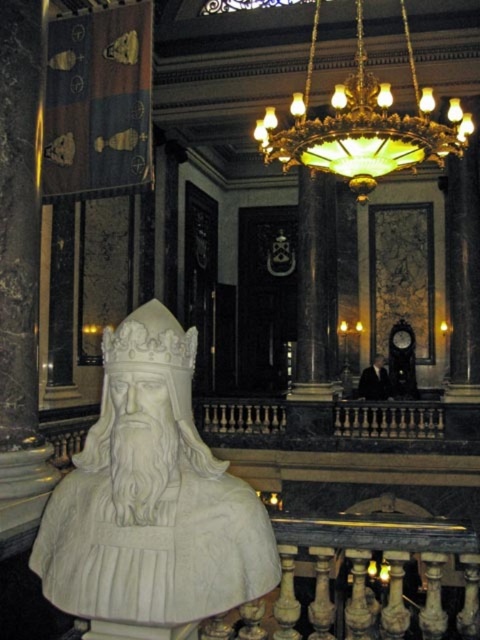
Question: Can you confirm if white marble bust at center is positioned below green stained glass chandelier at upper center?

Choices:
 (A) no
 (B) yes

Answer: (B)

Question: Can you confirm if white marble bust at center is positioned above green stained glass chandelier at upper center?

Choices:
 (A) no
 (B) yes

Answer: (A)

Question: Which of the following is the closest to the observer?

Choices:
 (A) white marble bust at center
 (B) green stained glass chandelier at upper center

Answer: (A)

Question: Can you confirm if white marble bust at center is positioned above green stained glass chandelier at upper center?

Choices:
 (A) no
 (B) yes

Answer: (A)